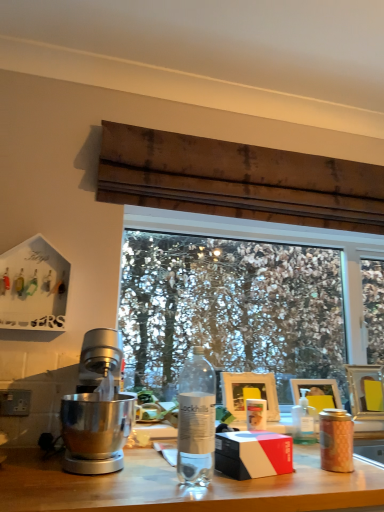
Find the location of `metallic silver picture frame at right, acting as the first picture frame starting from the right`. metallic silver picture frame at right, acting as the first picture frame starting from the right is located at coordinates (365, 391).

The height and width of the screenshot is (512, 384). Describe the element at coordinates (365, 391) in the screenshot. I see `metallic silver picture frame at right, acting as the first picture frame starting from the right` at that location.

What are the coordinates of `matte gold canister at right, which appears as the second coffee cup when viewed from the back` in the screenshot? It's located at (336, 440).

What are the coordinates of `clear plastic bottle at center, the 1th bottle in the bottom-to-top sequence` in the screenshot? It's located at (305, 421).

What do you see at coordinates (317, 392) in the screenshot? Image resolution: width=384 pixels, height=512 pixels. I see `wooden picture frame at right, arranged as the 2th picture frame when viewed from the right` at bounding box center [317, 392].

Measure the distance between matte black box at center and camera.

The distance of matte black box at center from camera is 1.14 meters.

The height and width of the screenshot is (512, 384). In order to click on satin silver power outlet at lower left in this screenshot , I will do [x=15, y=402].

Is matte gold canister at right, which is counted as the second coffee cup, starting from the left, completely or partially inside satin silver power outlet at lower left?

No, matte gold canister at right, which is counted as the second coffee cup, starting from the left, is located outside of satin silver power outlet at lower left.

Considering the sizes of objects satin silver power outlet at lower left and matte gold canister at right, the first coffee cup viewed from the right, in the image provided, who is taller, satin silver power outlet at lower left or matte gold canister at right, the first coffee cup viewed from the right,?

Standing taller between the two is matte gold canister at right, the first coffee cup viewed from the right.

Considering the sizes of satin silver power outlet at lower left and matte gold canister at right, which appears as the second coffee cup when viewed from the back, in the image, is satin silver power outlet at lower left wider or thinner than matte gold canister at right, which appears as the second coffee cup when viewed from the back,?

In the image, satin silver power outlet at lower left appears to be more narrow than matte gold canister at right, which appears as the second coffee cup when viewed from the back.

From the image's perspective, which one is positioned lower, matte gold canister at right, the first coffee cup viewed from the right, or clear plastic bottle at center, the 1th bottle in the back-to-front sequence?

clear plastic bottle at center, the 1th bottle in the back-to-front sequence, is shown below in the image.

Between matte gold canister at right, which ranks as the 1th coffee cup in front-to-back order, and clear plastic bottle at center, positioned as the second bottle in left-to-right order, which one has smaller size?

With smaller size is clear plastic bottle at center, positioned as the second bottle in left-to-right order.

Is matte gold canister at right, the first coffee cup viewed from the right, aimed at clear plastic bottle at center, positioned as the second bottle in left-to-right order?

No, matte gold canister at right, the first coffee cup viewed from the right, is not aimed at clear plastic bottle at center, positioned as the second bottle in left-to-right order.

Consider the image. Is matte gold canister at right, the first coffee cup viewed from the right, far away from clear plastic bottle at center, the second bottle from the top?

No, there isn't a large distance between matte gold canister at right, the first coffee cup viewed from the right, and clear plastic bottle at center, the second bottle from the top.

Who is more distant, polished silver mixer at left or clear plastic bottle at center, the 1th bottle in the back-to-front sequence?

clear plastic bottle at center, the 1th bottle in the back-to-front sequence, is more distant.

Between polished silver mixer at left and clear plastic bottle at center, the 1th bottle in the bottom-to-top sequence, which one appears on the left side from the viewer's perspective?

From the viewer's perspective, polished silver mixer at left appears more on the left side.

You are a GUI agent. You are given a task and a screenshot of the screen. Output one action in this format:
    pyautogui.click(x=<x>, y=<y>)
    Task: Click on the 2nd bottle located beneath the polished silver mixer at left (from a real-world perspective)
    Image resolution: width=384 pixels, height=512 pixels.
    Given the screenshot: What is the action you would take?
    pyautogui.click(x=305, y=421)

Is transparent glass window at center not near clear plastic bottle at center, which is the second bottle from front to back?

Yes, transparent glass window at center is far from clear plastic bottle at center, which is the second bottle from front to back.

Would you say transparent glass window at center is inside or outside clear plastic bottle at center, positioned as the second bottle in left-to-right order?

transparent glass window at center is spatially situated outside clear plastic bottle at center, positioned as the second bottle in left-to-right order.

How different are the orientations of transparent glass window at center and clear plastic bottle at center, which is the first bottle from right to left, in degrees?

transparent glass window at center and clear plastic bottle at center, which is the first bottle from right to left, are facing 0.47 degrees away from each other.

Who is bigger, transparent glass window at center or clear plastic bottle at center, the 1th bottle in the back-to-front sequence?

With larger size is transparent glass window at center.

Does metallic silver picture frame at right, acting as the first picture frame starting from the right, appear on the left side of wooden picture frame at right, arranged as the 2th picture frame when viewed from the right?

In fact, metallic silver picture frame at right, acting as the first picture frame starting from the right, is to the right of wooden picture frame at right, arranged as the 2th picture frame when viewed from the right.

Between point (356, 389) and point (316, 407), which one is positioned behind?

Point (356, 389)

Which of these two, metallic silver picture frame at right, acting as the first picture frame starting from the right, or wooden picture frame at right, the second picture frame when ordered from left to right, stands shorter?

With less height is wooden picture frame at right, the second picture frame when ordered from left to right.

Does metallic silver picture frame at right, acting as the first picture frame starting from the right, contain wooden picture frame at right, the second picture frame when ordered from left to right?

No, wooden picture frame at right, the second picture frame when ordered from left to right, is not surrounded by metallic silver picture frame at right, acting as the first picture frame starting from the right.

Considering the sizes of objects pink matte coffee cup at center, which ranks as the second coffee cup in front-to-back order, and white matte picture frame at center, which is the 1th picture frame in left-to-right order, in the image provided, who is smaller, pink matte coffee cup at center, which ranks as the second coffee cup in front-to-back order, or white matte picture frame at center, which is the 1th picture frame in left-to-right order,?

pink matte coffee cup at center, which ranks as the second coffee cup in front-to-back order.

Is pink matte coffee cup at center, acting as the 1th coffee cup starting from the back, positioned beyond the bounds of white matte picture frame at center, which is the 1th picture frame in left-to-right order?

That's correct, pink matte coffee cup at center, acting as the 1th coffee cup starting from the back, is outside of white matte picture frame at center, which is the 1th picture frame in left-to-right order.

From a real-world perspective, between pink matte coffee cup at center, which ranks as the second coffee cup in front-to-back order, and white matte picture frame at center, which is the 1th picture frame in left-to-right order, who is vertically lower?

pink matte coffee cup at center, which ranks as the second coffee cup in front-to-back order, is physically lower.

Is pink matte coffee cup at center, arranged as the 1th coffee cup when viewed from the left, wider than white matte picture frame at center, which is the 1th picture frame in left-to-right order?

Yes, pink matte coffee cup at center, arranged as the 1th coffee cup when viewed from the left, is wider than white matte picture frame at center, which is the 1th picture frame in left-to-right order.

Where is `the 2nd bottle in front of the wooden picture frame at right, the second picture frame when ordered from left to right, counting from the anchor's position`? the 2nd bottle in front of the wooden picture frame at right, the second picture frame when ordered from left to right, counting from the anchor's position is located at coordinates (196, 420).

Is clear glass bottle at center, the first bottle in the left-to-right sequence, aimed at wooden picture frame at right, the second picture frame when ordered from left to right?

No, clear glass bottle at center, the first bottle in the left-to-right sequence, is not aimed at wooden picture frame at right, the second picture frame when ordered from left to right.

Is clear glass bottle at center, the first bottle in the left-to-right sequence, touching wooden picture frame at right, the second picture frame when ordered from left to right?

clear glass bottle at center, the first bottle in the left-to-right sequence, and wooden picture frame at right, the second picture frame when ordered from left to right, are not in contact.

Considering the sizes of clear glass bottle at center, placed as the first bottle when sorted from top to bottom, and wooden picture frame at right, the second picture frame when ordered from left to right, in the image, is clear glass bottle at center, placed as the first bottle when sorted from top to bottom, taller or shorter than wooden picture frame at right, the second picture frame when ordered from left to right,?

Clearly, clear glass bottle at center, placed as the first bottle when sorted from top to bottom, is taller compared to wooden picture frame at right, the second picture frame when ordered from left to right.

From a real-world perspective, starting from the satin silver power outlet at lower left, which coffee cup is the 2nd one below it? Please provide its 2D coordinates.

[(336, 440)]

What are the coordinates of `the 2nd coffee cup in front of the clear plastic bottle at center, the 1th bottle in the back-to-front sequence` in the screenshot? It's located at (336, 440).

When comparing their distances from clear plastic bottle at center, the 1th bottle in the back-to-front sequence, does polished silver mixer at left or transparent glass window at center seem closer?

polished silver mixer at left.

Considering their positions, is clear plastic bottle at center, positioned as the second bottle in left-to-right order, positioned further to pink matte coffee cup at center, arranged as the 1th coffee cup when viewed from the left, than satin silver power outlet at lower left?

Among the two, satin silver power outlet at lower left is located further to pink matte coffee cup at center, arranged as the 1th coffee cup when viewed from the left.

Estimate the real-world distances between objects in this image. Which object is further from white matte picture frame at center, the third picture frame from the right, wooden picture frame at right, the second picture frame when ordered from left to right, or clear plastic bottle at center, which is the second bottle from front to back?

wooden picture frame at right, the second picture frame when ordered from left to right, is further to white matte picture frame at center, the third picture frame from the right.

From the image, which object appears to be nearer to metallic silver picture frame at right, acting as the first picture frame starting from the right, satin silver power outlet at lower left or polished silver mixer at left?

Among the two, polished silver mixer at left is located nearer to metallic silver picture frame at right, acting as the first picture frame starting from the right.

When comparing their distances from matte black box at center, does white matte picture frame at center, which is the 1th picture frame in left-to-right order, or pink matte coffee cup at center, arranged as the 1th coffee cup when viewed from the left, seem closer?

The object closer to matte black box at center is pink matte coffee cup at center, arranged as the 1th coffee cup when viewed from the left.

From the image, which object appears to be farther from matte black box at center, transparent glass window at center or white matte picture frame at center, the third picture frame from the right?

Based on the image, transparent glass window at center appears to be further to matte black box at center.

Which object lies nearer to the anchor point white matte picture frame at center, the third picture frame from the right, matte black box at center or polished silver mixer at left?

Based on the image, matte black box at center appears to be nearer to white matte picture frame at center, the third picture frame from the right.

When comparing their distances from wooden picture frame at right, the second picture frame when ordered from left to right, does matte gold canister at right, which ranks as the 1th coffee cup in front-to-back order, or matte black box at center seem further?

matte black box at center.

You are a GUI agent. You are given a task and a screenshot of the screen. Output one action in this format:
    pyautogui.click(x=<x>, y=<y>)
    Task: Click on the bottle located between polished silver mixer at left and clear plastic bottle at center, which is the second bottle from front to back, in the left-right direction
    The image size is (384, 512).
    Given the screenshot: What is the action you would take?
    pyautogui.click(x=196, y=420)

The image size is (384, 512). What are the coordinates of `window between polished silver mixer at left and clear plastic bottle at center, which is the first bottle from right to left, in the horizontal direction` in the screenshot? It's located at (240, 297).

Where is `picture frame situated between satin silver power outlet at lower left and transparent glass window at center from left to right`? picture frame situated between satin silver power outlet at lower left and transparent glass window at center from left to right is located at coordinates (249, 393).

The image size is (384, 512). Find the location of `window between white matte picture frame at center, the third picture frame from the right, and metallic silver picture frame at right, which ranks as the 3th picture frame in left-to-right order, in the horizontal direction`. window between white matte picture frame at center, the third picture frame from the right, and metallic silver picture frame at right, which ranks as the 3th picture frame in left-to-right order, in the horizontal direction is located at coordinates (240, 297).